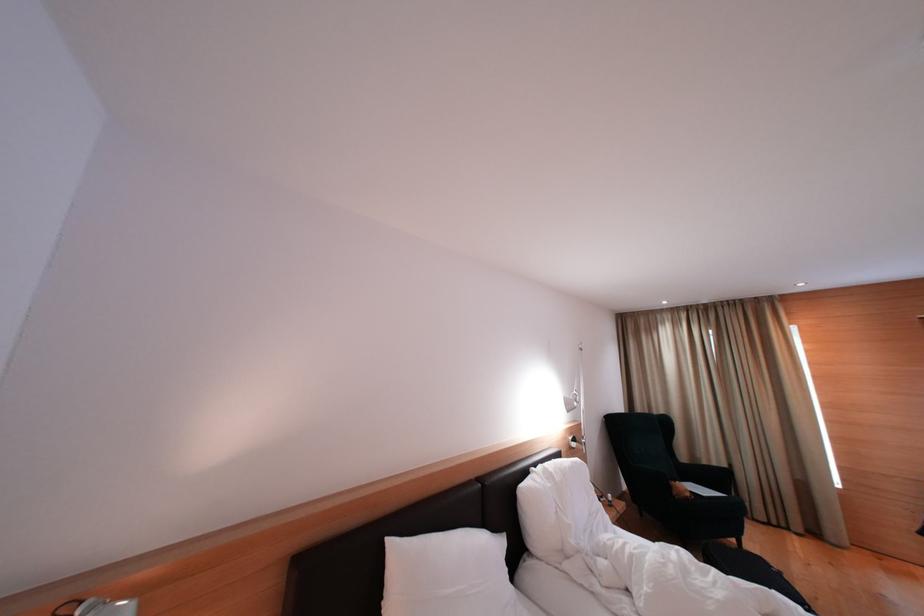
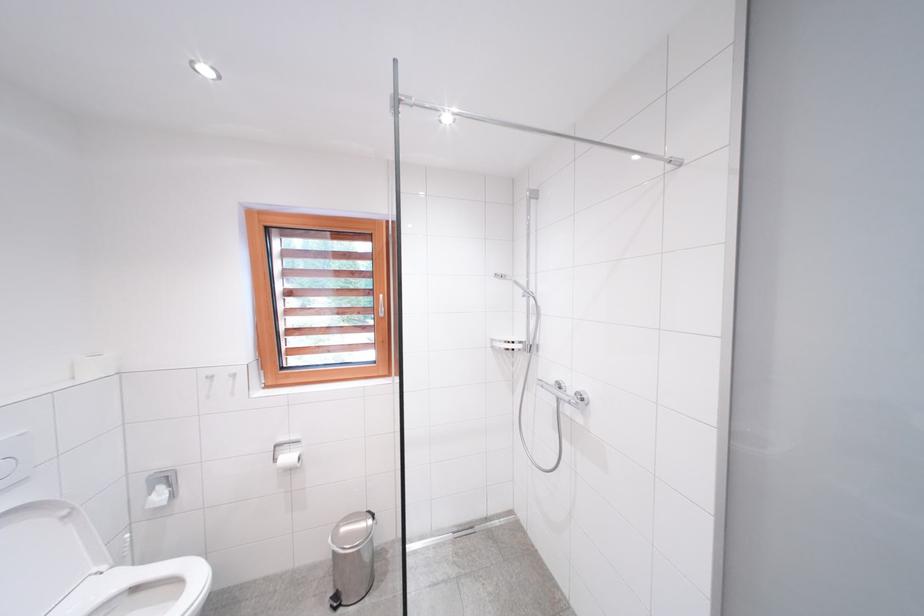
What movement of the cameraman would produce the second image?

The movement direction of the cameraman is left, backward.